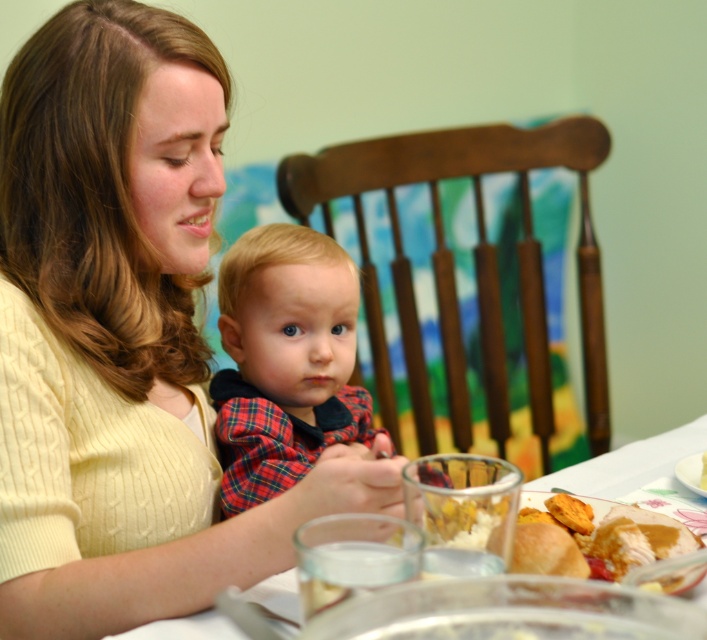
Question: Does clear glass plate at center have a lesser width compared to golden brown bread at lower right?

Choices:
 (A) yes
 (B) no

Answer: (B)

Question: Does plaid fabric shirt at center have a lesser width compared to white creamy bread at center?

Choices:
 (A) no
 (B) yes

Answer: (A)

Question: Which point is farther to the camera?

Choices:
 (A) (658, 579)
 (B) (701, 481)

Answer: (B)

Question: Which object is closer to the camera taking this photo?

Choices:
 (A) matte yellow sweater at center
 (B) plaid fabric shirt at center
 (C) golden brown bread at lower right
 (D) white creamy bread at center

Answer: (C)

Question: Is matte yellow sweater at center thinner than white creamy bread at center?

Choices:
 (A) yes
 (B) no

Answer: (B)

Question: Which of the following is the farthest from the observer?

Choices:
 (A) plaid fabric shirt at center
 (B) golden brown bread at lower right
 (C) clear glass plate at center

Answer: (C)